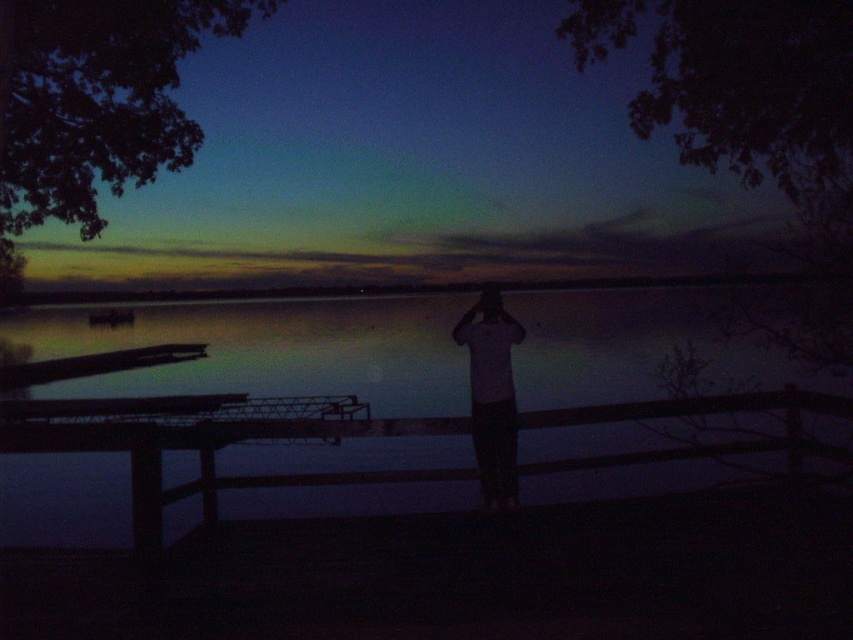
Question: Is transparent water at center to the left of white matte shirt at center from the viewer's perspective?

Choices:
 (A) yes
 (B) no

Answer: (A)

Question: Which point is farther to the camera?

Choices:
 (A) white matte shirt at center
 (B) transparent water at center

Answer: (A)

Question: Can you confirm if transparent water at center is smaller than white matte shirt at center?

Choices:
 (A) yes
 (B) no

Answer: (B)

Question: Can you confirm if transparent water at center is positioned above white matte shirt at center?

Choices:
 (A) no
 (B) yes

Answer: (B)